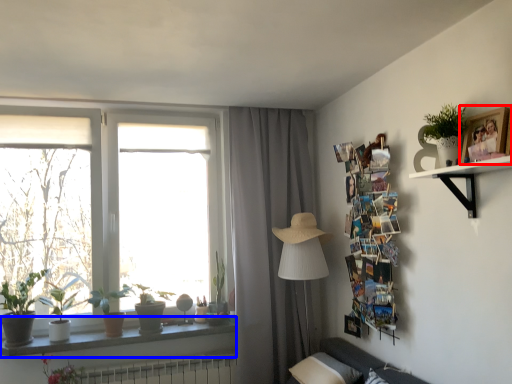
Question: Among these objects, which one is nearest to the camera, picture frame (highlighted by a red box) or window sill (highlighted by a blue box)?

Choices:
 (A) picture frame
 (B) window sill

Answer: (A)